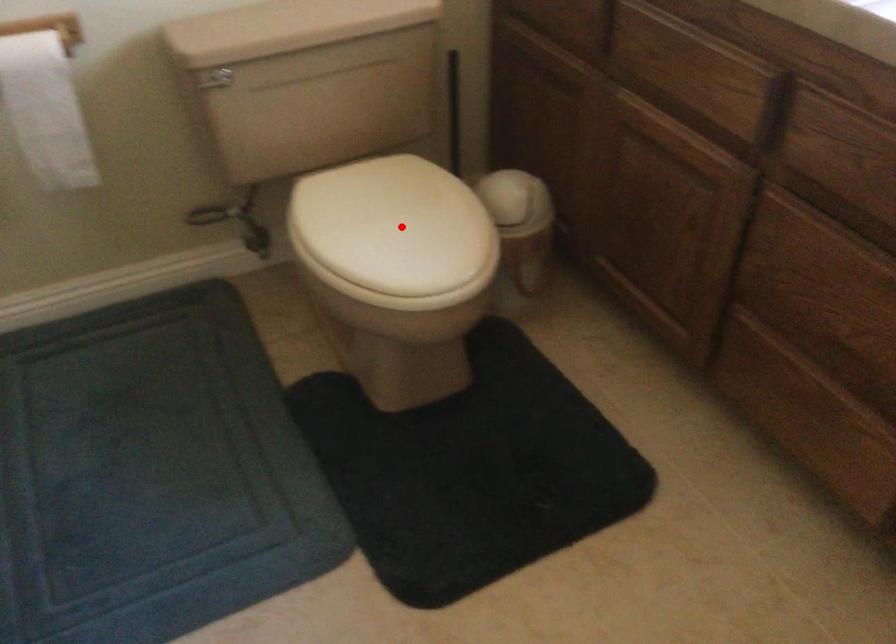
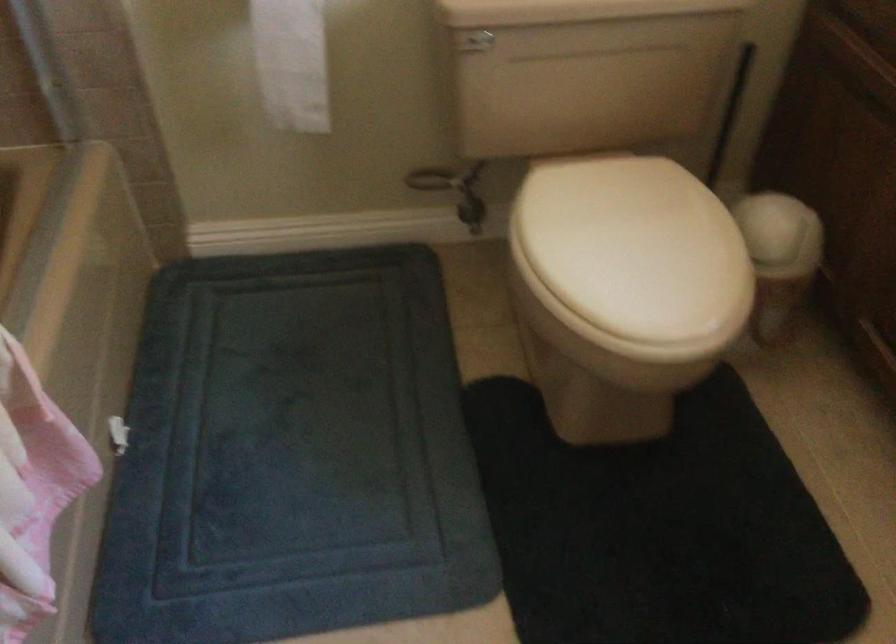
Where in the second image is the point corresponding to the highlighted location from the first image?

(634, 247)